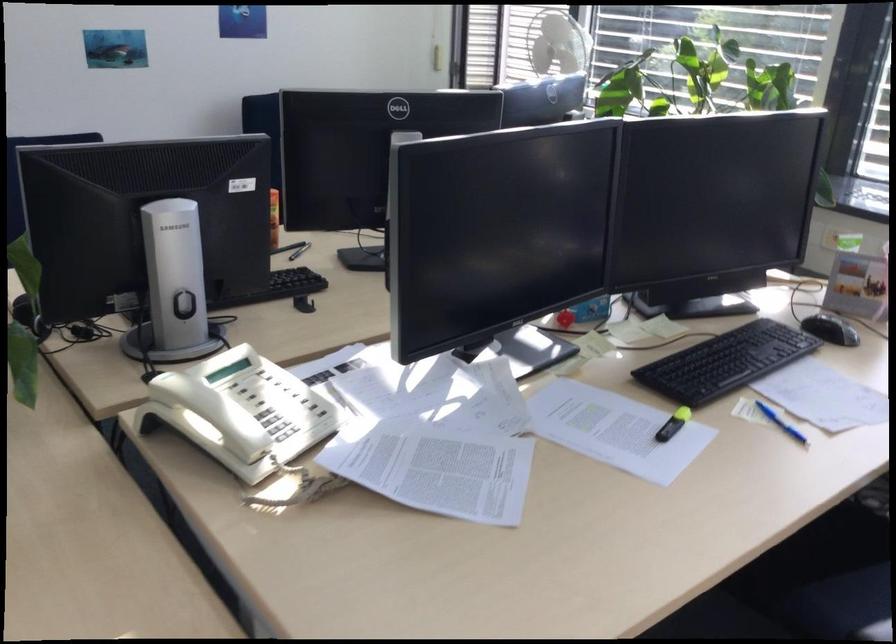
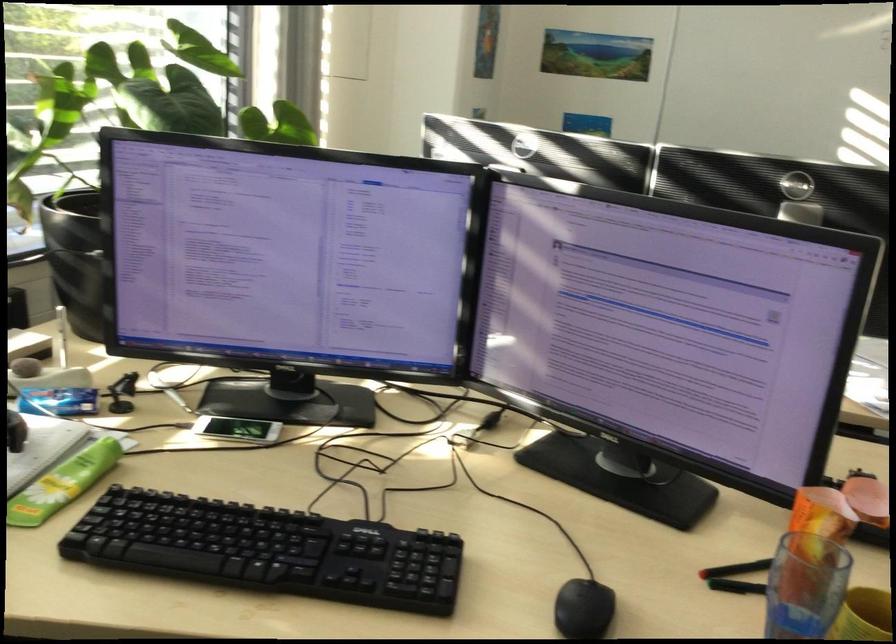
Locate, in the second image, the point that corresponds to the point at 314,254 in the first image.

(736, 569)